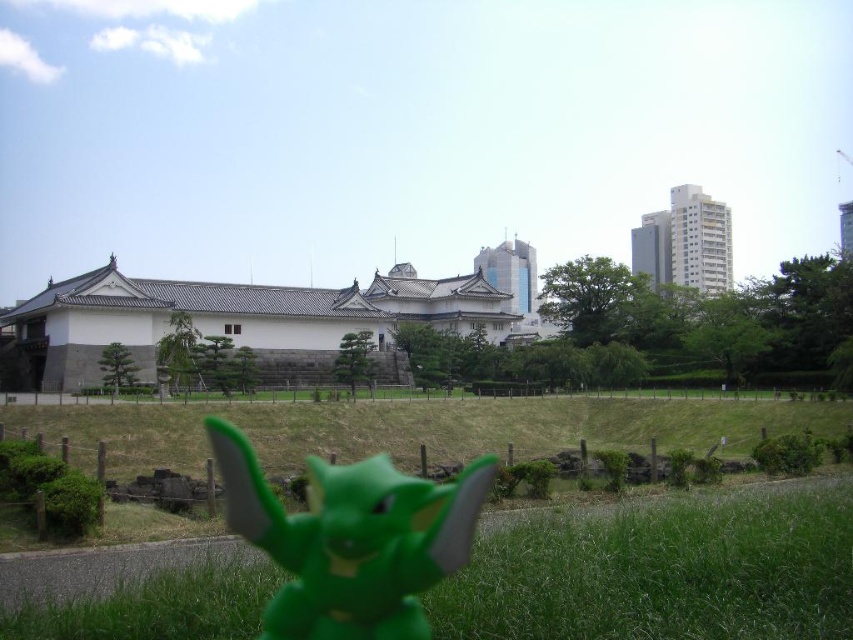
Question: Can you confirm if green grass at lower left is bigger than green matte toy at center?

Choices:
 (A) no
 (B) yes

Answer: (B)

Question: Does green matte grass at lower center have a lesser width compared to green matte toy at center?

Choices:
 (A) yes
 (B) no

Answer: (B)

Question: Does green grass at lower left have a larger size compared to green matte toy at center?

Choices:
 (A) no
 (B) yes

Answer: (B)

Question: Estimate the real-world distances between objects in this image. Which object is closer to the green grass at lower left?

Choices:
 (A) green matte grass at lower center
 (B) green matte toy at center

Answer: (B)

Question: Which point appears closest to the camera in this image?

Choices:
 (A) (434, 442)
 (B) (248, 564)

Answer: (B)

Question: Which point appears closest to the camera in this image?

Choices:
 (A) (845, 604)
 (B) (396, 611)

Answer: (B)